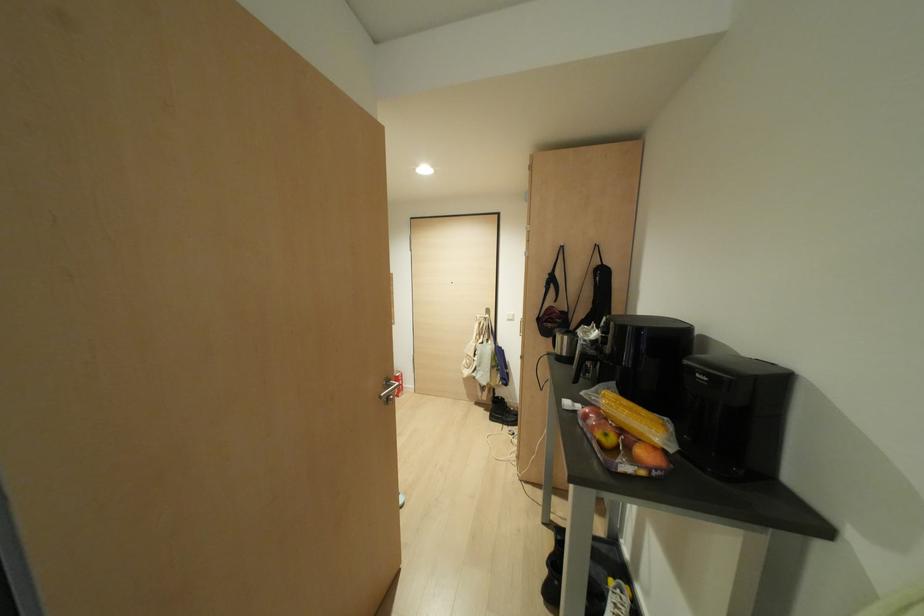
The image size is (924, 616). What do you see at coordinates (737, 368) in the screenshot?
I see `the black appliance lid` at bounding box center [737, 368].